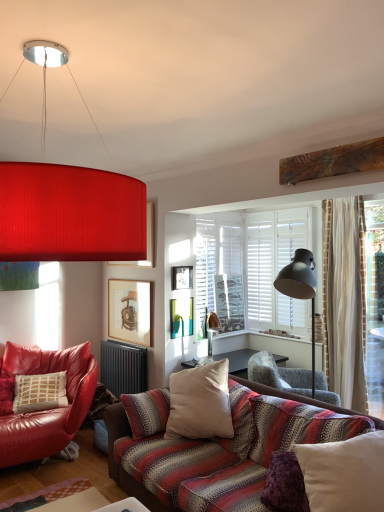
This screenshot has height=512, width=384. What do you see at coordinates (279, 375) in the screenshot?
I see `striped fabric chair at center, arranged as the first chair when viewed from the right` at bounding box center [279, 375].

Locate an element on the screen. black metallic radiator at lower center is located at coordinates (123, 368).

Where is `white matte window screen at center`? The image size is (384, 512). white matte window screen at center is located at coordinates (215, 256).

Where is `matte red lampshade at upper center`? Image resolution: width=384 pixels, height=512 pixels. matte red lampshade at upper center is located at coordinates (70, 214).

From a real-world perspective, relative to striped fabric chair at center, arranged as the first chair when viewed from the right, is leather chair at left, placed as the first chair when sorted from left to right, vertically above or below?

Clearly, from a real-world perspective, leather chair at left, placed as the first chair when sorted from left to right, is below striped fabric chair at center, arranged as the first chair when viewed from the right.

Is leather chair at left, which ranks as the second chair in right-to-left order, positioned in front of striped fabric chair at center, arranged as the first chair when viewed from the right?

Yes.

Which is correct: leather chair at left, placed as the first chair when sorted from left to right, is inside striped fabric chair at center, arranged as the first chair when viewed from the right, or outside of it?

leather chair at left, placed as the first chair when sorted from left to right, cannot be found inside striped fabric chair at center, arranged as the first chair when viewed from the right.

In the image, is leather chair at left, which ranks as the second chair in right-to-left order, on the left side or the right side of striped fabric chair at center, which is the second chair from left to right?

leather chair at left, which ranks as the second chair in right-to-left order, is positioned on striped fabric chair at center, which is the second chair from left to right,'s left side.

How many degrees apart are the facing directions of wooden framed picture of chair at center, the third picture frame when ordered from top to bottom, and matte red lampshade at upper center?

The angle between the facing direction of wooden framed picture of chair at center, the third picture frame when ordered from top to bottom, and the facing direction of matte red lampshade at upper center is 0.00276 degrees.

In terms of size, does wooden framed picture of chair at center, arranged as the 1th picture frame when ordered from the bottom, appear bigger or smaller than matte red lampshade at upper center?

Considering their sizes, wooden framed picture of chair at center, arranged as the 1th picture frame when ordered from the bottom, takes up less space than matte red lampshade at upper center.

Is wooden framed picture of chair at center, arranged as the 1th picture frame when ordered from the bottom, further to the viewer compared to matte red lampshade at upper center?

Yes, wooden framed picture of chair at center, arranged as the 1th picture frame when ordered from the bottom, is further from the camera.

Considering the relative sizes of wooden framed picture of chair at center, arranged as the 1th picture frame when ordered from the bottom, and matte red lampshade at upper center in the image provided, is wooden framed picture of chair at center, arranged as the 1th picture frame when ordered from the bottom, thinner than matte red lampshade at upper center?

Yes, wooden framed picture of chair at center, arranged as the 1th picture frame when ordered from the bottom, is thinner than matte red lampshade at upper center.

How many degrees apart are the facing directions of wooden framed picture of chair at center, arranged as the 1th picture frame when ordered from the bottom, and matte black floor lamp at right?

wooden framed picture of chair at center, arranged as the 1th picture frame when ordered from the bottom, and matte black floor lamp at right are facing 0.346 degrees away from each other.

Which is more to the right, wooden framed picture of chair at center, the third picture frame when ordered from top to bottom, or matte black floor lamp at right?

matte black floor lamp at right.

Starting from the matte black floor lamp at right, which picture frame is the 2nd one to the left? Please provide its 2D coordinates.

[(130, 311)]

From a real-world perspective, is wooden picture frame at center, positioned as the 2th picture frame in top-to-bottom order, located higher than matte wooden picture frame at upper center, placed as the first picture frame when sorted from top to bottom?

No, from a real-world perspective, wooden picture frame at center, positioned as the 2th picture frame in top-to-bottom order, is not on top of matte wooden picture frame at upper center, placed as the first picture frame when sorted from top to bottom.

From a real-world perspective, count 1st picture frames downward from the matte wooden picture frame at upper center, placed as the first picture frame when sorted from top to bottom, and point to it. Please provide its 2D coordinates.

[(182, 277)]

Considering the points (176, 279) and (111, 262), which point is behind, point (176, 279) or point (111, 262)?

The point (111, 262) is farther from the camera.

Does wooden picture frame at center, which appears as the 2th picture frame when ordered from the bottom, have a lesser height compared to matte wooden picture frame at upper center, placed as the first picture frame when sorted from top to bottom?

Yes, wooden picture frame at center, which appears as the 2th picture frame when ordered from the bottom, is shorter than matte wooden picture frame at upper center, placed as the first picture frame when sorted from top to bottom.

How far apart are wooden framed picture of chair at center, the third picture frame when ordered from top to bottom, and wooden picture frame at center, which appears as the 2th picture frame when ordered from the bottom?

wooden framed picture of chair at center, the third picture frame when ordered from top to bottom, and wooden picture frame at center, which appears as the 2th picture frame when ordered from the bottom, are 55.75 centimeters apart from each other.

Is wooden framed picture of chair at center, the third picture frame when ordered from top to bottom, with wooden picture frame at center, which appears as the 2th picture frame when ordered from the bottom?

No, wooden framed picture of chair at center, the third picture frame when ordered from top to bottom, is not in contact with wooden picture frame at center, which appears as the 2th picture frame when ordered from the bottom.

Consider the image. Considering the relative sizes of wooden framed picture of chair at center, the third picture frame when ordered from top to bottom, and wooden picture frame at center, which appears as the 2th picture frame when ordered from the bottom, in the image provided, is wooden framed picture of chair at center, the third picture frame when ordered from top to bottom, taller than wooden picture frame at center, which appears as the 2th picture frame when ordered from the bottom,?

Indeed, wooden framed picture of chair at center, the third picture frame when ordered from top to bottom, has a greater height compared to wooden picture frame at center, which appears as the 2th picture frame when ordered from the bottom.

Considering the positions of point (132, 292) and point (185, 274), is point (132, 292) closer or farther from the camera than point (185, 274)?

Point (132, 292) is positioned farther from the camera compared to point (185, 274).

Is white matte window screen at center at the back of wooden picture frame at center, which appears as the 2th picture frame when ordered from the bottom?

No, wooden picture frame at center, which appears as the 2th picture frame when ordered from the bottom, is not facing away from white matte window screen at center.

Is wooden picture frame at center, which appears as the 2th picture frame when ordered from the bottom, located outside white matte window screen at center?

Yes, wooden picture frame at center, which appears as the 2th picture frame when ordered from the bottom, is not within white matte window screen at center.

Does wooden picture frame at center, positioned as the 2th picture frame in top-to-bottom order, appear on the right side of white matte window screen at center?

In fact, wooden picture frame at center, positioned as the 2th picture frame in top-to-bottom order, is to the left of white matte window screen at center.

From the image's perspective, is black metallic radiator at lower center beneath wooden picture frame at center, positioned as the 2th picture frame in top-to-bottom order?

Yes.

Is black metallic radiator at lower center oriented towards wooden picture frame at center, which appears as the 2th picture frame when ordered from the bottom?

No, black metallic radiator at lower center is not aimed at wooden picture frame at center, which appears as the 2th picture frame when ordered from the bottom.

From a real-world perspective, is black metallic radiator at lower center above or below wooden picture frame at center, which appears as the 2th picture frame when ordered from the bottom?

Clearly, from a real-world perspective, black metallic radiator at lower center is below wooden picture frame at center, which appears as the 2th picture frame when ordered from the bottom.

Identify the location of chair below the striped fabric chair at center, arranged as the first chair when viewed from the right (from the image's perspective). The image size is (384, 512). (48, 410).

At what (x,y) coordinates should I click in order to perform the action: click on picture frame that is the 3rd one below the matte red lampshade at upper center (from a real-world perspective). Please return your answer as a coordinate pair (x, y). The width and height of the screenshot is (384, 512). Looking at the image, I should click on (130, 311).

Based on their spatial positions, is striped fabric chair at center, arranged as the first chair when viewed from the right, or white matte window screen at center closer to black metallic radiator at lower center?

Based on the image, white matte window screen at center appears to be nearer to black metallic radiator at lower center.

Looking at the image, which one is located further to wooden framed picture of chair at center, arranged as the 1th picture frame when ordered from the bottom, matte wooden picture frame at upper center, placed as the first picture frame when sorted from top to bottom, or leather chair at left, which ranks as the second chair in right-to-left order?

The object further to wooden framed picture of chair at center, arranged as the 1th picture frame when ordered from the bottom, is leather chair at left, which ranks as the second chair in right-to-left order.

When comparing their distances from matte red lampshade at upper center, does black metallic radiator at lower center or white cotton cushion at center seem closer?

white cotton cushion at center is positioned closer to the anchor matte red lampshade at upper center.

Consider the image. From the image, which object appears to be farther from striped fabric chair at center, arranged as the first chair when viewed from the right, white cotton cushion at center or white matte window screen at center?

Based on the image, white matte window screen at center appears to be further to striped fabric chair at center, arranged as the first chair when viewed from the right.

When comparing their distances from matte black floor lamp at right, does wooden picture frame at center, which appears as the 2th picture frame when ordered from the bottom, or white matte window screen at center seem further?

Based on the image, white matte window screen at center appears to be further to matte black floor lamp at right.

Looking at this image, looking at the image, which one is located closer to matte black floor lamp at right, leather chair at left, which ranks as the second chair in right-to-left order, or striped fabric chair at center, arranged as the first chair when viewed from the right?

striped fabric chair at center, arranged as the first chair when viewed from the right, is closer to matte black floor lamp at right.

Based on their spatial positions, is striped fabric chair at center, which is the second chair from left to right, or white matte window screen at center further from wooden framed picture of chair at center, arranged as the 1th picture frame when ordered from the bottom?

striped fabric chair at center, which is the second chair from left to right, is further to wooden framed picture of chair at center, arranged as the 1th picture frame when ordered from the bottom.

Looking at the image, which one is located closer to wooden framed picture of chair at center, the third picture frame when ordered from top to bottom, matte black floor lamp at right or matte red lampshade at upper center?

matte black floor lamp at right is closer to wooden framed picture of chair at center, the third picture frame when ordered from top to bottom.

I want to click on table lamp located between matte red lampshade at upper center and matte wooden picture frame at upper center, the 3th picture frame when ordered from bottom to top, in the depth direction, so click(x=300, y=288).

Find the location of a particular element. radiator positioned between matte black floor lamp at right and white matte window screen at center from near to far is located at coordinates (123, 368).

Identify the location of table lamp positioned between matte red lampshade at upper center and striped fabric chair at center, which is the second chair from left to right, from near to far. (300, 288).

At what (x,y) coordinates should I click in order to perform the action: click on picture frame between matte wooden picture frame at upper center, placed as the first picture frame when sorted from top to bottom, and wooden framed picture of chair at center, arranged as the 1th picture frame when ordered from the bottom, from top to bottom. Please return your answer as a coordinate pair (x, y). This screenshot has width=384, height=512. Looking at the image, I should click on (182, 277).